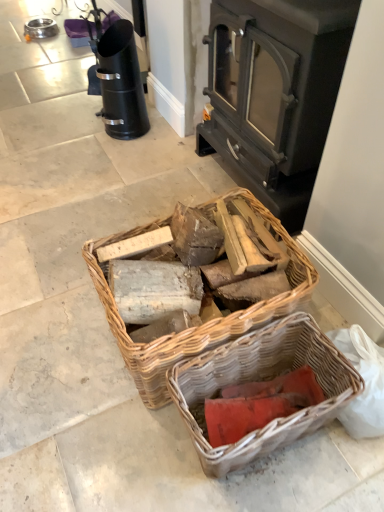
Identify the location of blank space to the left of rustic wicker basket at lower center, which is the 1th picnic basket in bottom-to-top order. (125, 444).